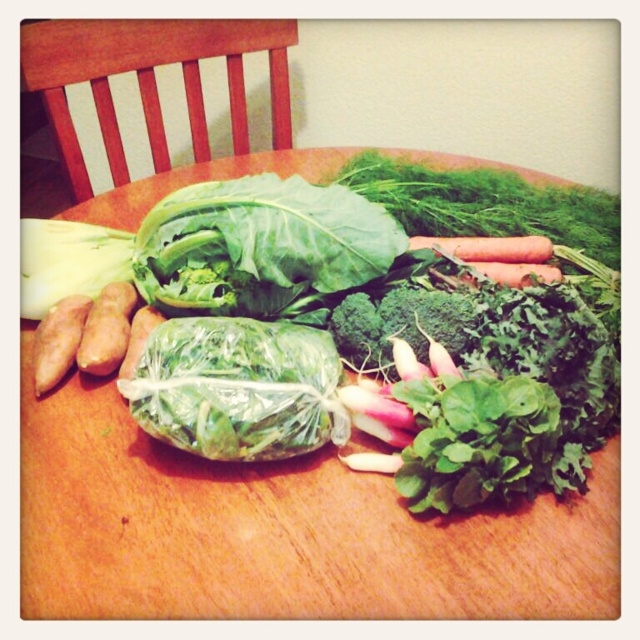
You are preparing a vegetable platter and have the smooth orange sweet potato at left and the orange smooth carrot at center in front of you. Which vegetable should you choose if you want the smaller one for a garnish?

The smooth orange sweet potato at left is smaller in size compared to the orange smooth carrot at center, so you should choose the smooth orange sweet potato at left for the garnish.

You are holding a ruler and want to measure the distance between the broccoli and the camera. The broccoli is located at point (108, 323). Can you determine the distance using the ruler?

The broccoli at point (108, 323) is 19.67 inches away from the camera, so yes, you can measure this distance using the ruler.

You are arranging vegetables on a table and need to place a new item between the brown matte sweet potato at left and the orange smooth carrot at center. Based on their positions, which vegetable should you place closer to you?

The brown matte sweet potato at left is closer to the viewer than the orange smooth carrot at center, so you should place the new item closer to the brown matte sweet potato at left to maintain the spatial arrangement.